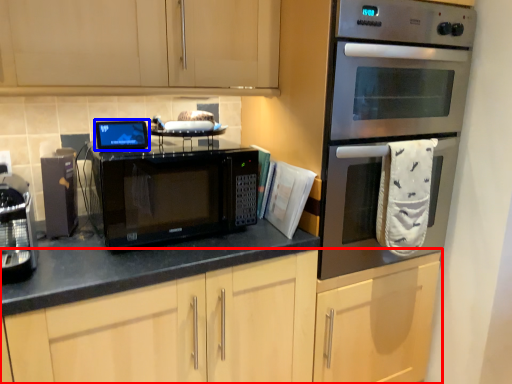
Question: Which object is closer to the camera taking this photo, cabinetry (highlighted by a red box) or appliance (highlighted by a blue box)?

Choices:
 (A) cabinetry
 (B) appliance

Answer: (A)